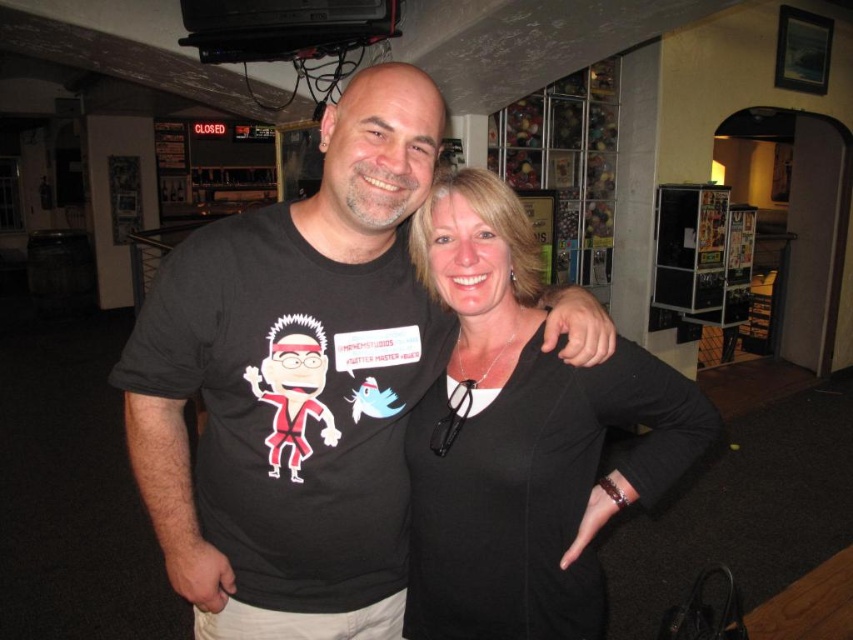
Question: Can you confirm if black matte t-shirt at center is positioned to the left of black matte shirt at center?

Choices:
 (A) yes
 (B) no

Answer: (A)

Question: Among these objects, which one is farthest from the camera?

Choices:
 (A) black matte t-shirt at center
 (B) black matte shirt at center

Answer: (B)

Question: Observing the image, what is the correct spatial positioning of black matte t-shirt at center in reference to black matte shirt at center?

Choices:
 (A) below
 (B) above

Answer: (B)

Question: Which point is farther to the camera?

Choices:
 (A) black matte t-shirt at center
 (B) black matte shirt at center

Answer: (B)

Question: Does black matte t-shirt at center have a greater width compared to black matte shirt at center?

Choices:
 (A) yes
 (B) no

Answer: (A)